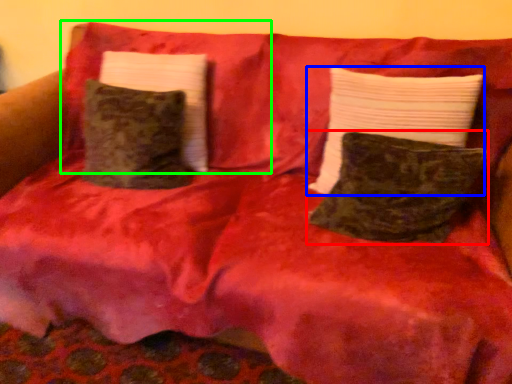
Question: Based on their relative distances, which object is farther from pillow (highlighted by a red box)? Choose from pillow (highlighted by a blue box) and pillow (highlighted by a green box).

Choices:
 (A) pillow
 (B) pillow

Answer: (B)